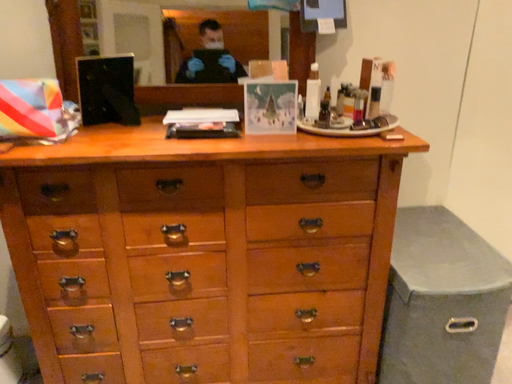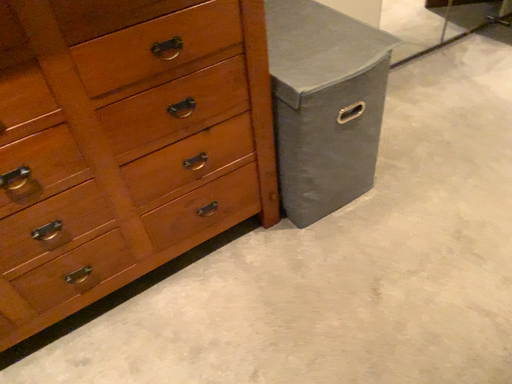
Question: Which way did the camera rotate in the video?

Choices:
 (A) rotated upward
 (B) rotated downward

Answer: (B)